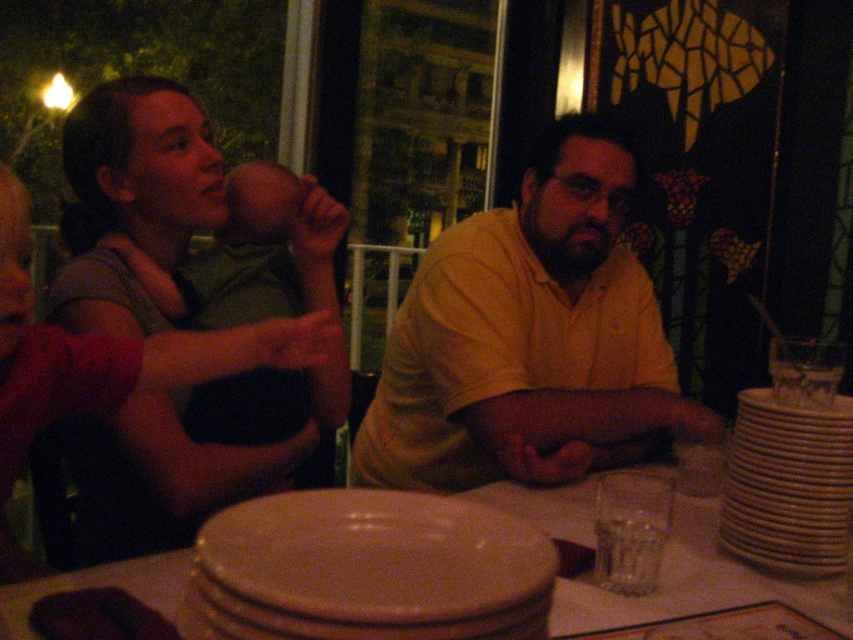
Question: Considering the relative positions of yellow matte shirt at center and white ceramic stack at right in the image provided, where is yellow matte shirt at center located with respect to white ceramic stack at right?

Choices:
 (A) above
 (B) below

Answer: (A)

Question: Which point is farther from the camera taking this photo?

Choices:
 (A) (22, 630)
 (B) (492, 424)

Answer: (B)

Question: Which of these objects is positioned closest to the yellow matte shirt at center?

Choices:
 (A) matte ceramic plate at center
 (B) matte green shirt at left
 (C) white ceramic stack at right
 (D) matte ceramic plates at center

Answer: (D)

Question: Does matte green shirt at left come in front of matte ceramic plates at center?

Choices:
 (A) no
 (B) yes

Answer: (A)

Question: Among these objects, which one is farthest from the camera?

Choices:
 (A) matte green shirt at left
 (B) matte ceramic plates at center
 (C) white ceramic stack at right
 (D) yellow matte shirt at center

Answer: (D)

Question: Is matte green shirt at left to the right of matte ceramic plates at center from the viewer's perspective?

Choices:
 (A) no
 (B) yes

Answer: (A)